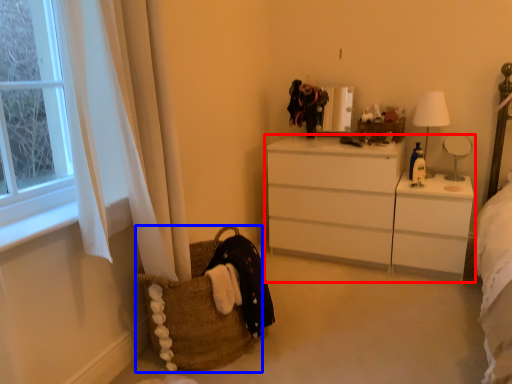
Question: Which of the following is the farthest to the observer, chest of drawers (highlighted by a red box) or picnic basket (highlighted by a blue box)?

Choices:
 (A) chest of drawers
 (B) picnic basket

Answer: (A)